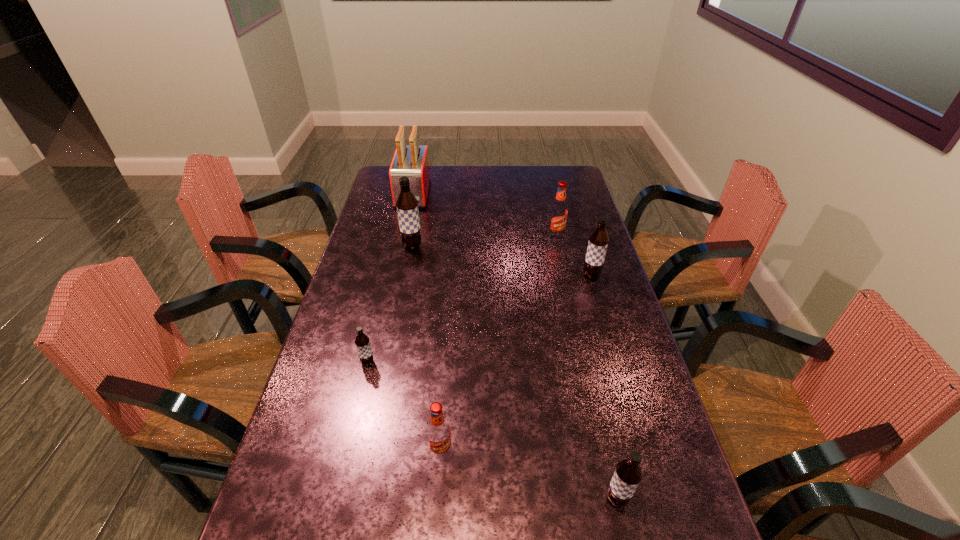
This screenshot has width=960, height=540. In order to click on vacant space positioned 0.290m on the right of the smallest brown root beer in this screenshot , I will do `click(482, 363)`.

You are a GUI agent. You are given a task and a screenshot of the screen. Output one action in this format:
    pyautogui.click(x=<x>, y=<y>)
    Task: Click on the object that is at the far edge
    Image resolution: width=960 pixels, height=540 pixels.
    Given the screenshot: What is the action you would take?
    pyautogui.click(x=412, y=161)

The height and width of the screenshot is (540, 960). Find the location of `toaster that is at the left edge`. toaster that is at the left edge is located at coordinates (412, 161).

Locate an element on the screen. The height and width of the screenshot is (540, 960). object present at the far left corner is located at coordinates (412, 161).

Locate an element on the screen. blank space at the left edge is located at coordinates (396, 214).

In order to click on free location at the right edge of the desktop in this screenshot , I will do coord(596,228).

In the image, there is a desktop. Identify the location of free space at the far right corner. This screenshot has width=960, height=540. (558, 169).

The image size is (960, 540). What are the coordinates of `free area in between the smaller red root beer and the red toaster` in the screenshot? It's located at (427, 323).

Image resolution: width=960 pixels, height=540 pixels. Identify the location of free space between the farther red root beer and the red toaster. (484, 215).

I want to click on vacant space in between the leftmost root beer and the sixth farthest object, so click(404, 407).